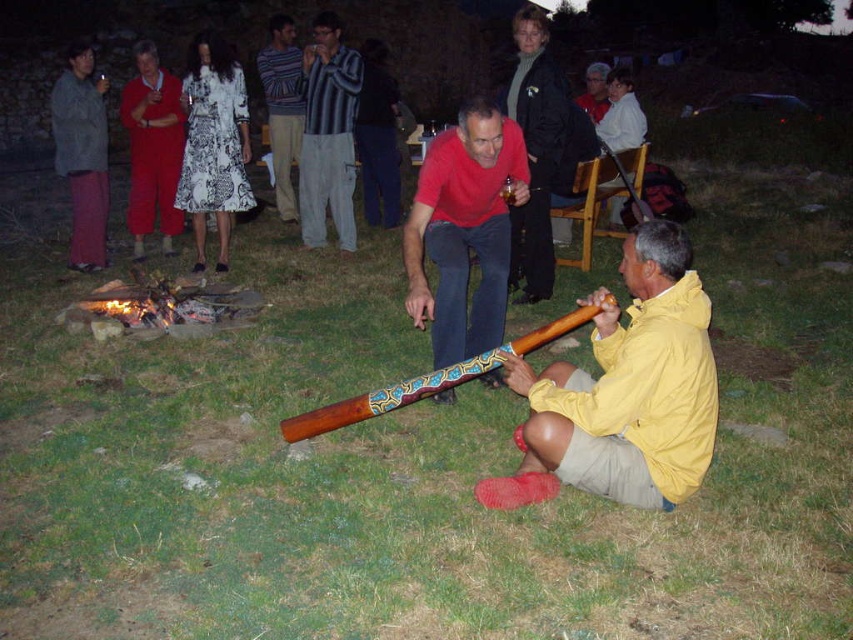
You are planning to place a 15 feet long decorative pole between the yellow matte jacket at lower right and the brushed metal didgeridoo at upper left. Will the pole fit between them without overlapping either object?

The distance between the yellow matte jacket at lower right and the brushed metal didgeridoo at upper left is 16.05 feet. Since the pole is 15 feet long, it will fit between them without overlapping either object as there is enough space.

You are standing at the fire pit and want to walk to the didgeridoo player. Which point, point [531,404] or point [96,196], is closer to your starting position?

Point [531,404] is closer to the viewer than point [96,196]. Since you are starting at the fire pit, which is near the center, the closer point would be point [531,404].